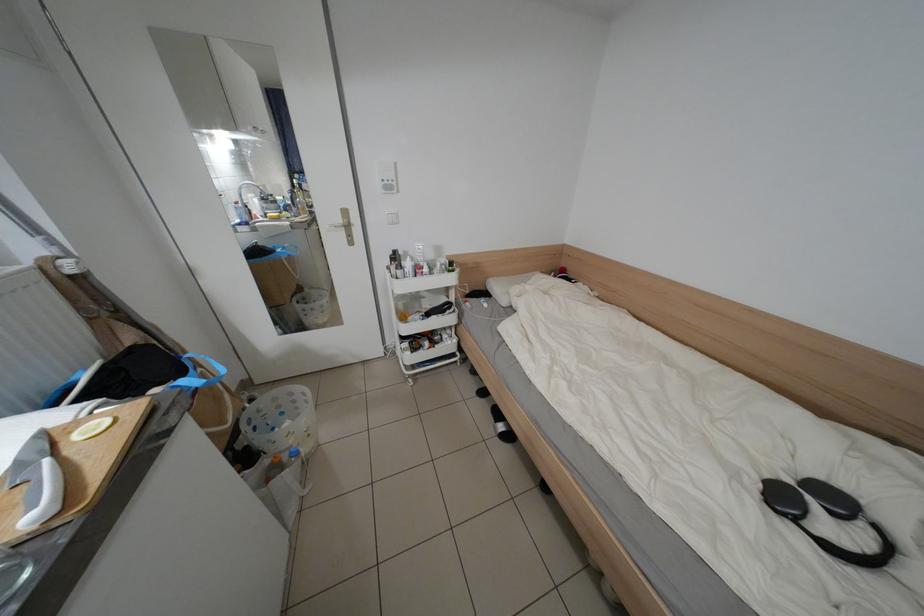
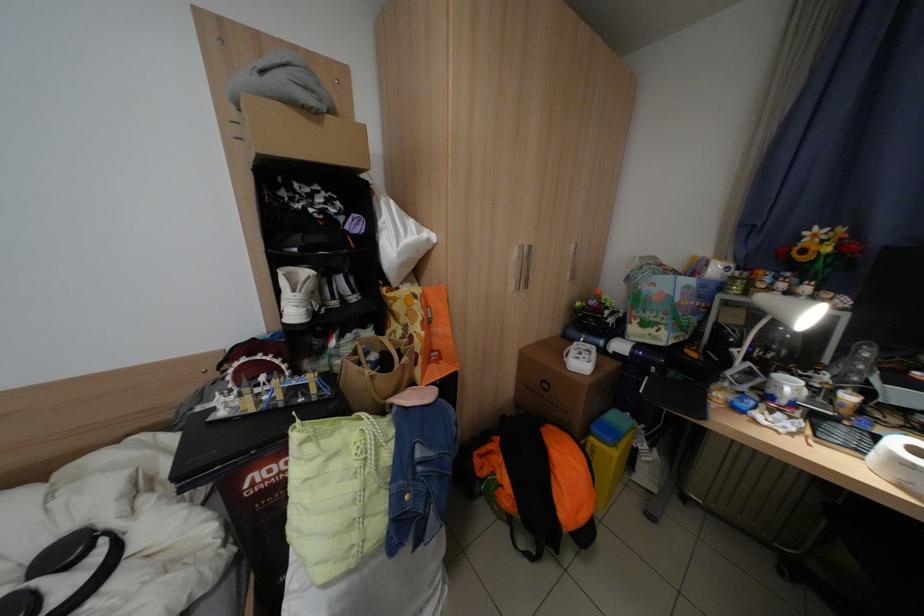
First-person continuous shooting, in which direction is the camera rotating?

The camera rotated toward right-down.